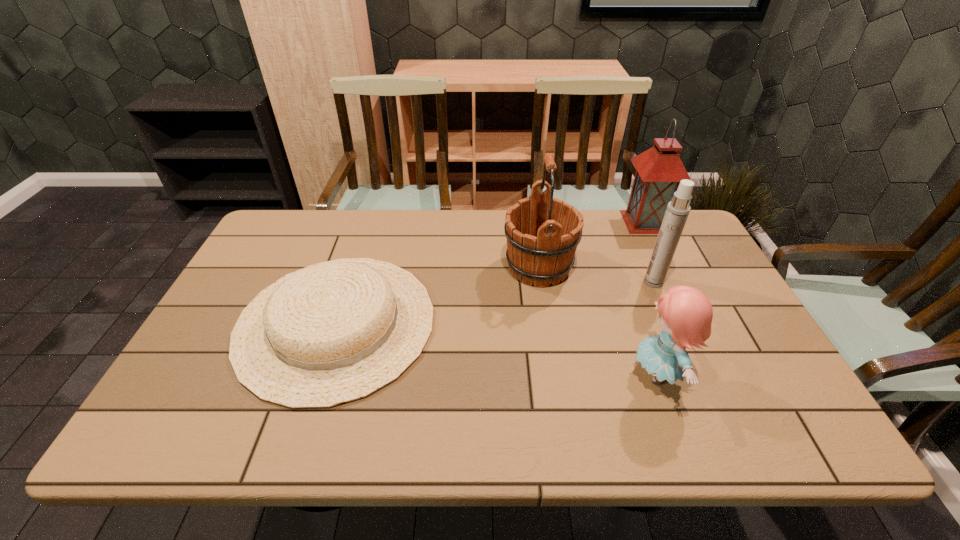
This screenshot has height=540, width=960. Identify the location of free location located on the front-facing side of the fourth tallest object. (503, 374).

The width and height of the screenshot is (960, 540). In order to click on vacant space situated on the front-facing side of the fourth tallest object in this screenshot , I will do `click(609, 374)`.

In order to click on vacant space located on the right of the sunhat in this screenshot , I will do `click(474, 323)`.

Find the location of a particular element. lantern present at the far edge is located at coordinates (659, 170).

Where is `wine bucket that is at the far edge`? The height and width of the screenshot is (540, 960). wine bucket that is at the far edge is located at coordinates (542, 232).

You are a GUI agent. You are given a task and a screenshot of the screen. Output one action in this format:
    pyautogui.click(x=<x>, y=<y>)
    Task: Click on the doll that is at the near edge
    The image size is (960, 540).
    Given the screenshot: What is the action you would take?
    pyautogui.click(x=686, y=314)

Locate an element on the screen. The image size is (960, 540). sunhat that is at the near edge is located at coordinates click(x=333, y=332).

The width and height of the screenshot is (960, 540). I want to click on object situated at the left edge, so [x=333, y=332].

What are the coordinates of `object that is at the right edge` in the screenshot? It's located at (659, 170).

Locate an element on the screen. This screenshot has height=540, width=960. object that is at the near left corner is located at coordinates point(333,332).